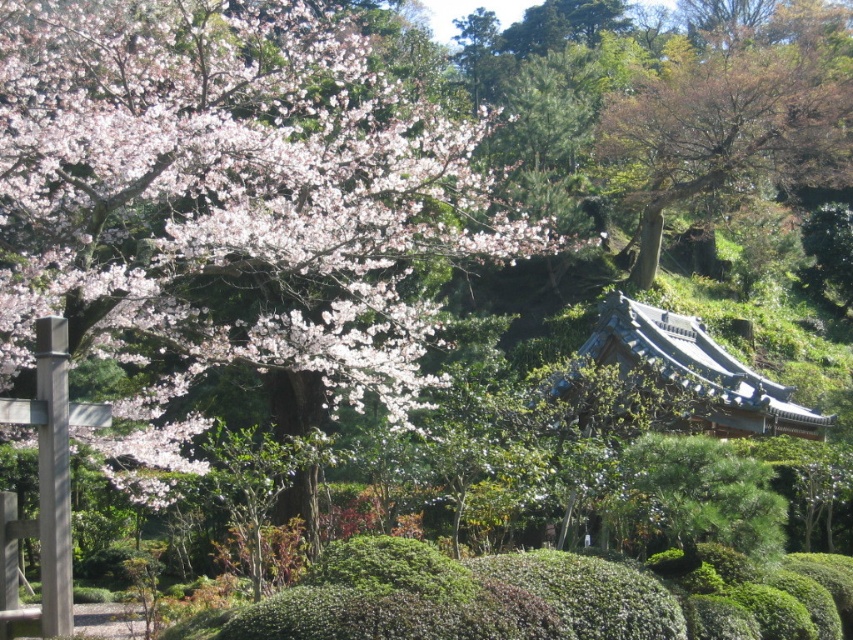
Is soft pink blossoms at upper left positioned at the back of brown textured tree at upper right?

That is False.

Does soft pink blossoms at upper left lie in front of brown textured tree at upper right?

Yes, soft pink blossoms at upper left is in front of brown textured tree at upper right.

Between point (171, 120) and point (848, 99), which one is positioned behind?

Point (848, 99)

This screenshot has height=640, width=853. Find the location of `soft pink blossoms at upper left`. soft pink blossoms at upper left is located at coordinates (231, 195).